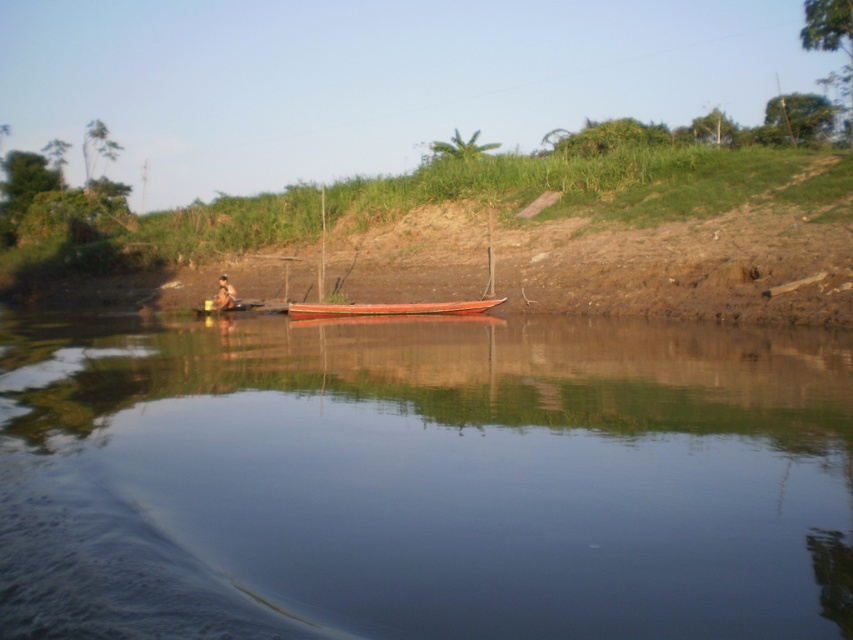
Question: Which point is farther from the camera taking this photo?

Choices:
 (A) (173, 396)
 (B) (321, 317)
 (C) (223, 280)

Answer: (C)

Question: Is smooth water at center closer to camera compared to brown wooden person at lower left?

Choices:
 (A) no
 (B) yes

Answer: (B)

Question: Is smooth wooden canoe at center positioned in front of brown wooden person at lower left?

Choices:
 (A) yes
 (B) no

Answer: (A)

Question: Considering the real-world distances, which object is closest to the brown wooden person at lower left?

Choices:
 (A) smooth wooden canoe at center
 (B) smooth water at center

Answer: (A)

Question: Does smooth water at center appear under smooth wooden canoe at center?

Choices:
 (A) no
 (B) yes

Answer: (B)

Question: Which point is closer to the camera?

Choices:
 (A) smooth water at center
 (B) smooth wooden canoe at center

Answer: (A)